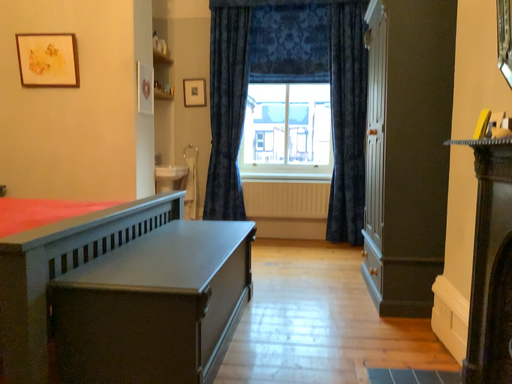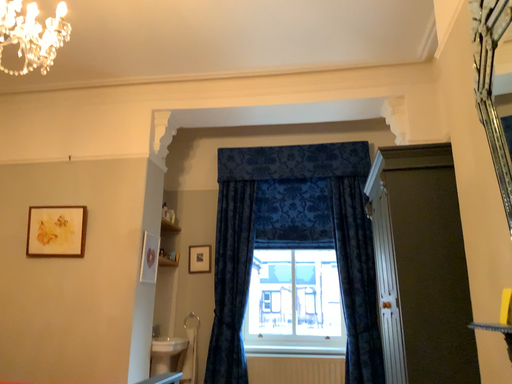
Question: How did the camera likely rotate when shooting the video?

Choices:
 (A) rotated downward
 (B) rotated upward

Answer: (B)